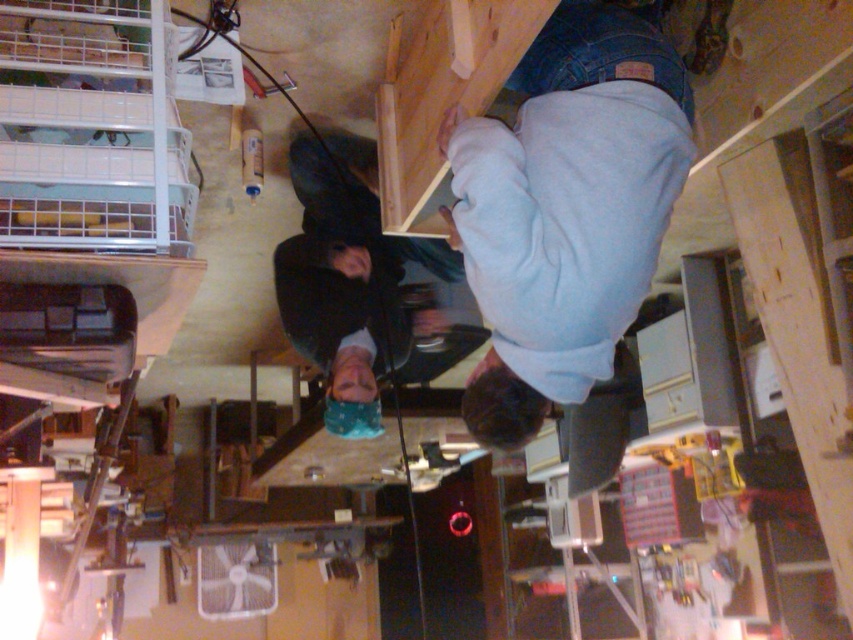
Question: Where is light blue cotton shirt at upper center located in relation to dark blue fabric at center in the image?

Choices:
 (A) below
 (B) above

Answer: (B)

Question: Which of the following is the farthest from the observer?

Choices:
 (A) light blue cotton shirt at upper center
 (B) dark blue fabric at center

Answer: (B)

Question: Which object is farther from the camera taking this photo?

Choices:
 (A) dark blue fabric at center
 (B) light blue cotton shirt at upper center

Answer: (A)

Question: From the image, what is the correct spatial relationship of light blue cotton shirt at upper center in relation to dark blue fabric at center?

Choices:
 (A) right
 (B) left

Answer: (A)

Question: Does light blue cotton shirt at upper center appear on the left side of dark blue fabric at center?

Choices:
 (A) no
 (B) yes

Answer: (A)